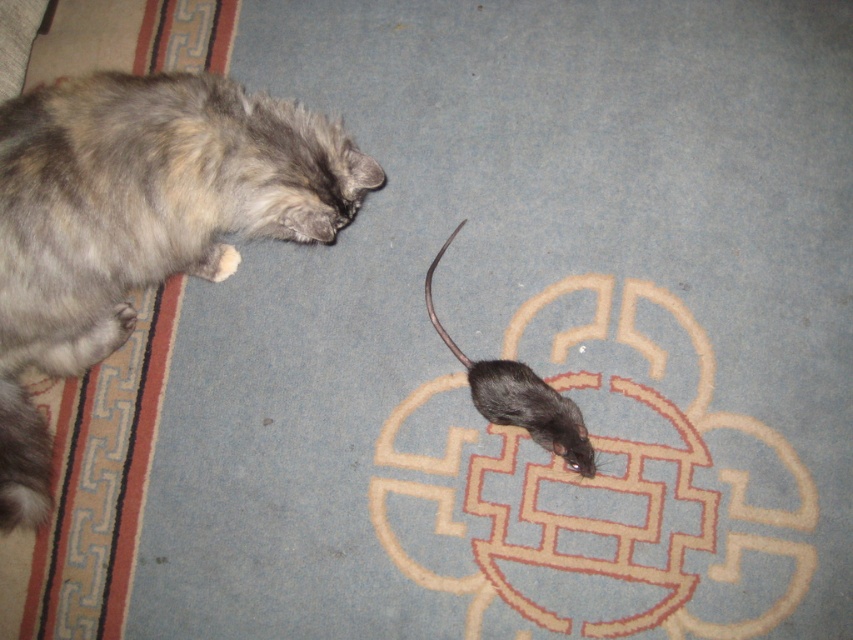
You are a photographer setting up a shot of the gray fluffy cat at left and the black matte mouse at center. If you want to frame the two subjects so that the cat is on the left side of the mouse, is the current arrangement correct?

Yes, the current arrangement is correct because the gray fluffy cat at left is already positioned to the left of the black matte mouse at center.

You are a photographer trying to capture the gray fluffy cat at left in a closeup shot. The camera you are using has a focal length of 85mm. To achieve the desired focus, you need to know the exact position of the cat. Based on the coordinates provided, can you determine the cat is positioned closer to the left or right side of the frame?

The gray fluffy cat at left is positioned closer to the left side of the frame since its coordinates are at point (138, 220), which places it near the left edge.